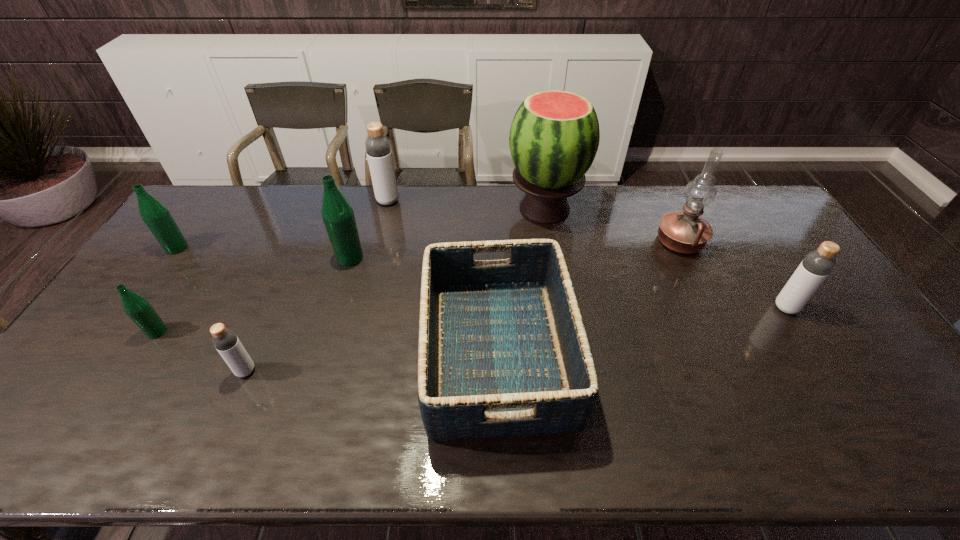
Locate an element on the screen. This screenshot has height=540, width=960. the second bottle from left to right is located at coordinates (139, 310).

At what (x,y) coordinates should I click in order to perform the action: click on the second green bottle from right to left. Please return your answer as a coordinate pair (x, y). Looking at the image, I should click on (139, 310).

The width and height of the screenshot is (960, 540). What are the coordinates of `the smallest gray bottle` in the screenshot? It's located at (225, 341).

Locate an element on the screen. The image size is (960, 540). the leftmost gray bottle is located at coordinates (225, 341).

Identify the location of free space located 0.200m on the left of the green watermelon. (450, 209).

The image size is (960, 540). I want to click on free space located on the front of the eighth object from left to right, so click(x=700, y=285).

At what (x,y) coordinates should I click in order to perform the action: click on free region located on the right of the farthest gray bottle. Please return your answer as a coordinate pair (x, y). The width and height of the screenshot is (960, 540). Looking at the image, I should click on (448, 201).

Where is `free region located 0.140m on the front of the rightmost green bottle`? free region located 0.140m on the front of the rightmost green bottle is located at coordinates (337, 301).

What are the coordinates of `free space located on the front of the leftmost object` in the screenshot? It's located at (151, 285).

At what (x,y) coordinates should I click in order to perform the action: click on free spot located 0.100m on the back of the fourth farthest bottle. Please return your answer as a coordinate pair (x, y). The image size is (960, 540). Looking at the image, I should click on (765, 274).